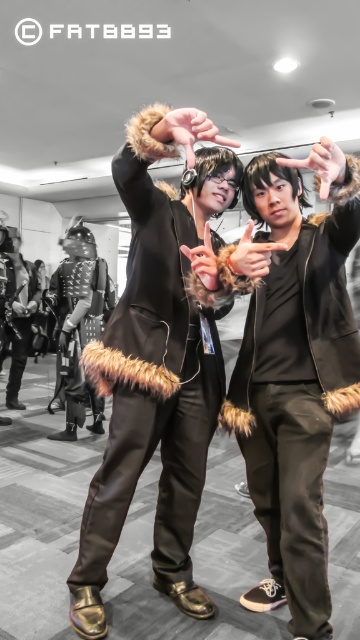
Question: Does furry black jacket at center lie in front of studded leather armor at center?

Choices:
 (A) yes
 (B) no

Answer: (A)

Question: Does fur-trimmed coat at center have a lesser width compared to velvet black vest at center?

Choices:
 (A) yes
 (B) no

Answer: (B)

Question: Which of the following is the closest to the observer?

Choices:
 (A) (312, 499)
 (B) (83, 269)

Answer: (A)

Question: Which point appears farthest from the camera in this image?

Choices:
 (A) (272, 490)
 (B) (75, 368)
 (C) (119, 518)
 (D) (33, 310)

Answer: (D)

Question: Which object appears farthest from the camera in this image?

Choices:
 (A) furry black jacket at center
 (B) fur-trimmed coat at center
 (C) studded leather armor at center

Answer: (C)

Question: Considering the relative positions of studded leather armor at center and velvet black vest at center in the image provided, where is studded leather armor at center located with respect to velvet black vest at center?

Choices:
 (A) below
 (B) above

Answer: (A)